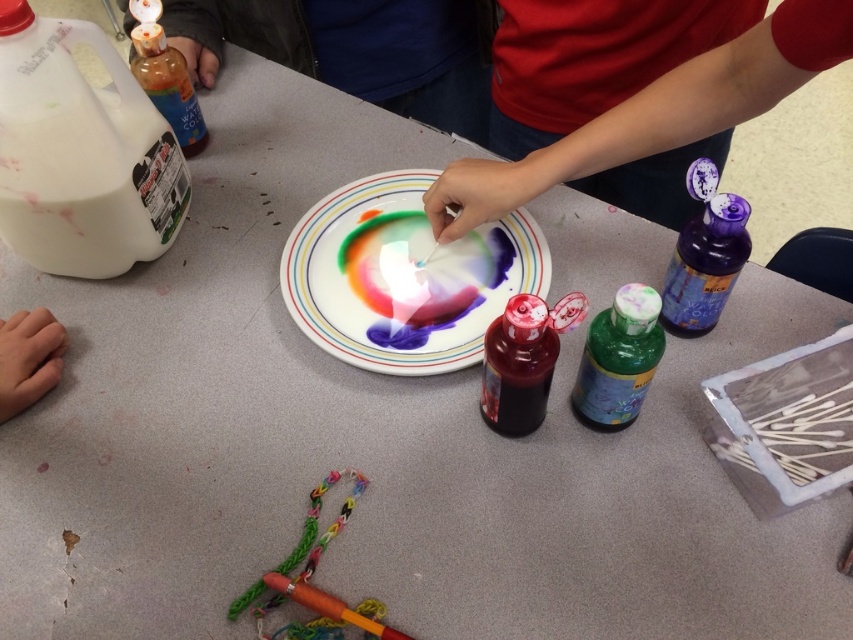
Question: Does green matte bottle at center lie in front of burgundy glass bottle at center?

Choices:
 (A) yes
 (B) no

Answer: (A)

Question: Is purple translucent bottle at upper right closer to the viewer compared to orange matte crayon at lower center?

Choices:
 (A) yes
 (B) no

Answer: (B)

Question: Which point is closer to the camera?

Choices:
 (A) skinny flesh at lower left
 (B) green matte bottle at center

Answer: (B)

Question: Is smooth red shirt at upper right to the right of orange matte crayon at lower center from the viewer's perspective?

Choices:
 (A) no
 (B) yes

Answer: (B)

Question: Which object is closer to the camera taking this photo?

Choices:
 (A) blue cotton shirt at upper center
 (B) green matte bottle at center
 (C) purple translucent bottle at upper right

Answer: (B)

Question: Among these points, which one is farthest from the camera?

Choices:
 (A) (763, 29)
 (B) (605, 372)

Answer: (B)